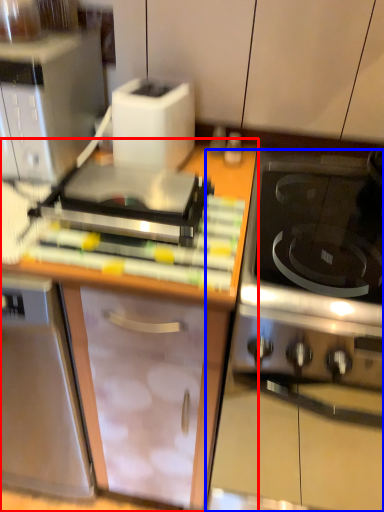
Question: Which object appears farthest to the camera in this image, cabinetry (highlighted by a red box) or oven (highlighted by a blue box)?

Choices:
 (A) cabinetry
 (B) oven

Answer: (A)